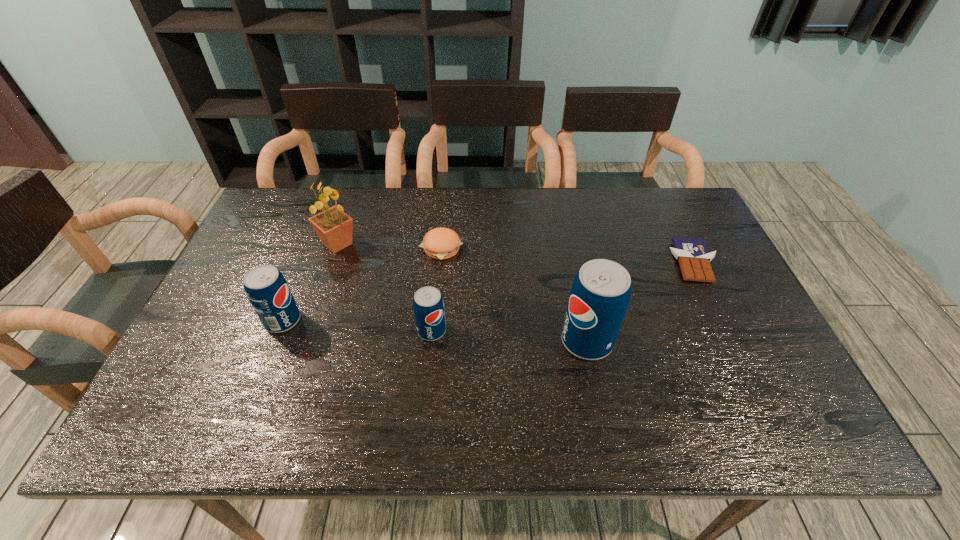
The width and height of the screenshot is (960, 540). Identify the location of free space between the shortest object and the shortest pop. pyautogui.click(x=563, y=296).

The image size is (960, 540). Identify the location of free space between the shortest object and the tallest pop. (640, 301).

The image size is (960, 540). Identify the location of free space that is in between the patty and the third tallest object. (362, 285).

What are the coordinates of `free space between the patty and the chocolate bar` in the screenshot? It's located at (567, 255).

Locate an element on the screen. Image resolution: width=960 pixels, height=540 pixels. free point between the patty and the leftmost pop is located at coordinates click(362, 285).

Identify which object is the fourth closest to the rightmost pop. Please provide its 2D coordinates. Your answer should be formatted as a tuple, i.e. [(x, y)], where the tuple contains the x and y coordinates of a point satisfying the conditions above.

[(334, 227)]

Locate an element on the screen. This screenshot has width=960, height=540. object that is the fourth closest to the sunflower is located at coordinates (600, 294).

Image resolution: width=960 pixels, height=540 pixels. I want to click on pop that stands as the second closest to the sunflower, so click(428, 305).

Select which pop appears as the third closest to the rightmost object. Please provide its 2D coordinates. Your answer should be formatted as a tuple, i.e. [(x, y)], where the tuple contains the x and y coordinates of a point satisfying the conditions above.

[(266, 288)]

Where is `vacant area that satisfies the following two spatial constraints: 1. on the front side of the fifth object from left to right; 2. on the right side of the second shortest object`? The image size is (960, 540). vacant area that satisfies the following two spatial constraints: 1. on the front side of the fifth object from left to right; 2. on the right side of the second shortest object is located at coordinates click(x=433, y=341).